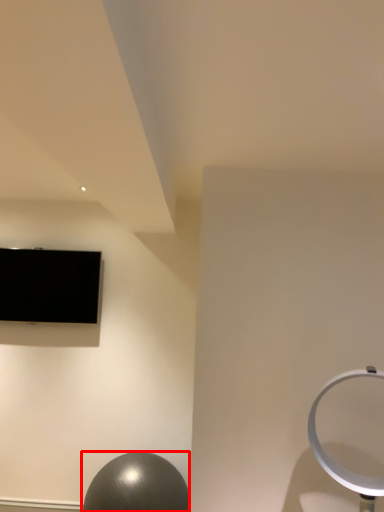
Question: Observing the image, what is the correct spatial positioning of ball (annotated by the red box) in reference to television?

Choices:
 (A) right
 (B) left

Answer: (A)